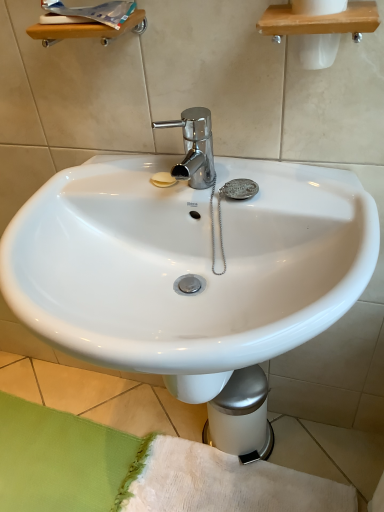
Question: From the image's perspective, is green fabric bath mat at lower left located above or below white glossy sink at center?

Choices:
 (A) above
 (B) below

Answer: (B)

Question: Considering the relative positions of green fabric bath mat at lower left and white glossy sink at center in the image provided, is green fabric bath mat at lower left to the left or to the right of white glossy sink at center?

Choices:
 (A) left
 (B) right

Answer: (A)

Question: In terms of width, does green fabric bath mat at lower left look wider or thinner when compared to white glossy sink at center?

Choices:
 (A) wide
 (B) thin

Answer: (A)

Question: Is white glossy sink at center wider or thinner than green fabric bath mat at lower left?

Choices:
 (A) wide
 (B) thin

Answer: (B)

Question: From a real-world perspective, is white glossy sink at center physically located above or below green fabric bath mat at lower left?

Choices:
 (A) above
 (B) below

Answer: (A)

Question: In terms of size, does white glossy sink at center appear bigger or smaller than green fabric bath mat at lower left?

Choices:
 (A) small
 (B) big

Answer: (B)

Question: Considering the relative positions of white glossy sink at center and green fabric bath mat at lower left in the image provided, is white glossy sink at center to the left or to the right of green fabric bath mat at lower left?

Choices:
 (A) right
 (B) left

Answer: (A)